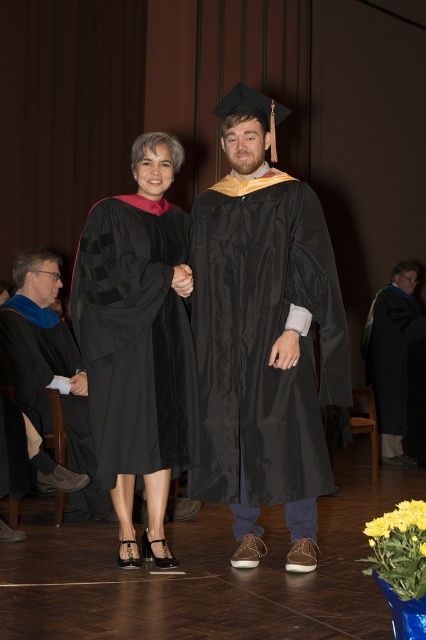
Question: Which is nearer to the matte black graduation gown at left?

Choices:
 (A) matte black graduation gown at center
 (B) matte black graduation gown at right
 (C) matte black gown at center

Answer: (C)

Question: Is matte black graduation gown at center below matte black graduation gown at left?

Choices:
 (A) no
 (B) yes

Answer: (A)

Question: Which of the following is the farthest from the observer?

Choices:
 (A) (363, 346)
 (B) (78, 260)
 (C) (46, 376)
 (D) (299, 417)

Answer: (A)

Question: Which object appears farthest from the camera in this image?

Choices:
 (A) matte black graduation gown at right
 (B) matte black gown at center

Answer: (A)

Question: Does matte black graduation gown at center come in front of matte black graduation gown at left?

Choices:
 (A) no
 (B) yes

Answer: (B)

Question: Is matte black graduation gown at center closer to the viewer compared to matte black graduation gown at left?

Choices:
 (A) yes
 (B) no

Answer: (A)